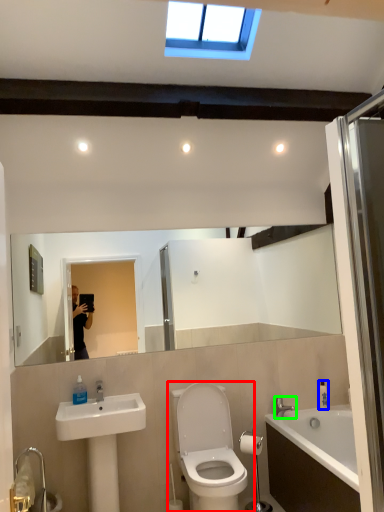
Question: Which object is positioned farthest from toilet (highlighted by a red box)? Select from toiletry (highlighted by a blue box) and tap (highlighted by a green box).

Choices:
 (A) toiletry
 (B) tap

Answer: (A)